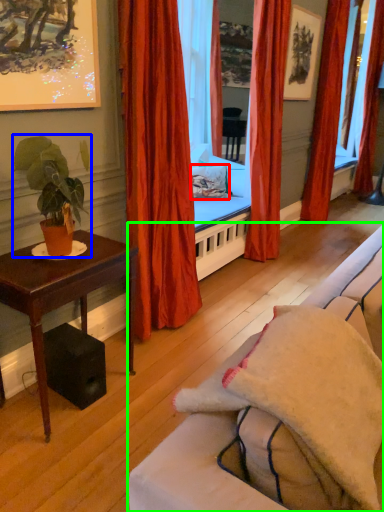
Question: Estimate the real-world distances between objects in this image. Which object is closer to pillow (highlighted by a red box), houseplant (highlighted by a blue box) or studio couch (highlighted by a green box)?

Choices:
 (A) houseplant
 (B) studio couch

Answer: (A)